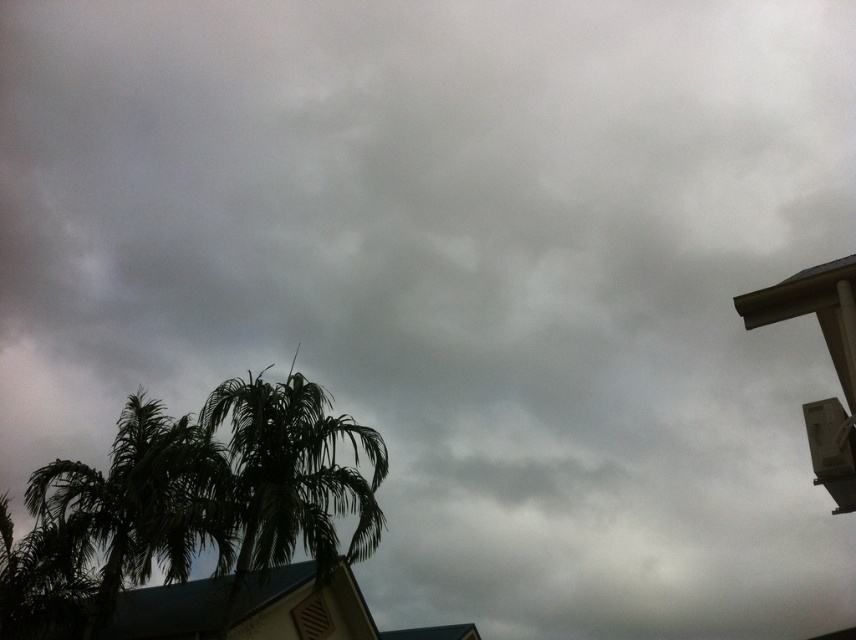
Based on the photo, is dark green leafy tree at lower left below green leafy palm tree at center?

Indeed, dark green leafy tree at lower left is positioned under green leafy palm tree at center.

Describe the element at coordinates (214, 490) in the screenshot. I see `dark green leafy tree at lower left` at that location.

Locate an element on the screen. Image resolution: width=856 pixels, height=640 pixels. dark green leafy tree at lower left is located at coordinates (214, 490).